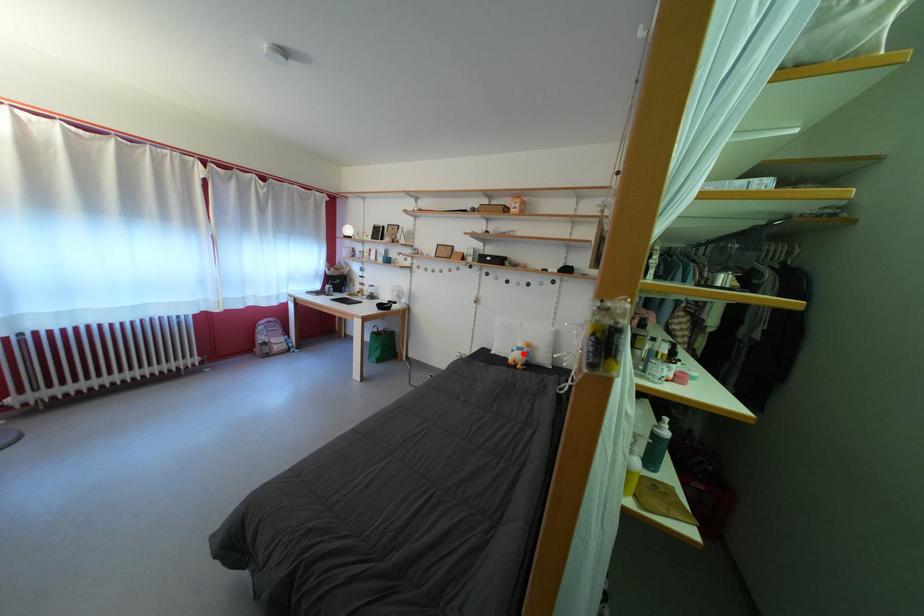
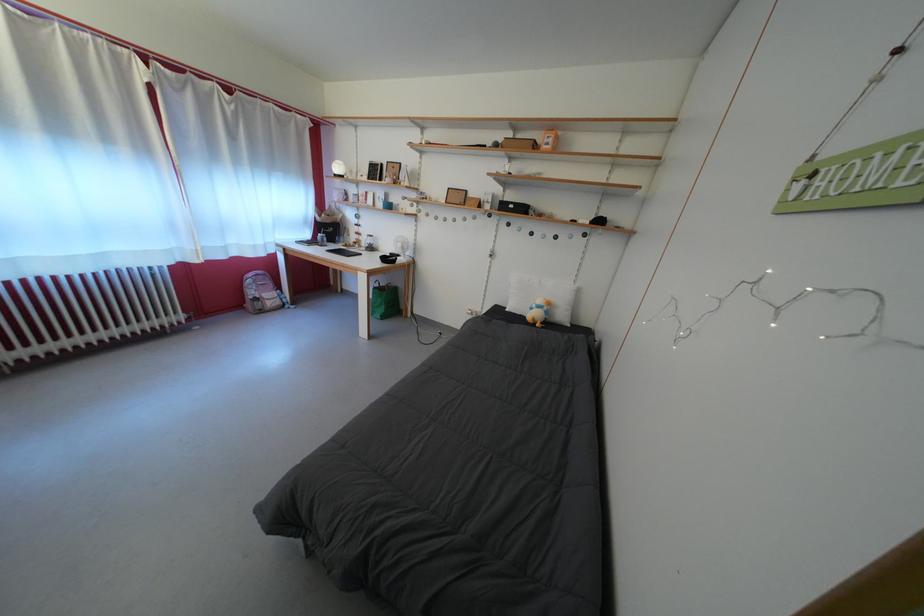
Locate, in the second image, the point that corresponds to the highlighted location in the first image.

(542, 312)